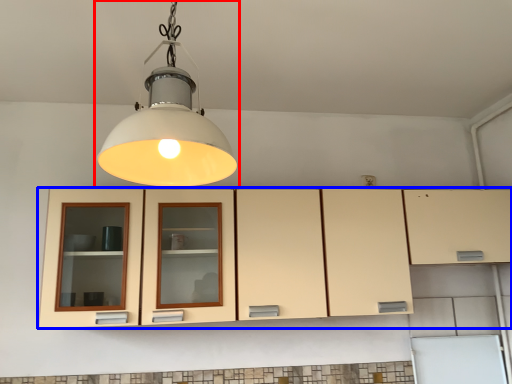
Question: Which object appears farthest to the camera in this image, lamp (highlighted by a red box) or cabinetry (highlighted by a blue box)?

Choices:
 (A) lamp
 (B) cabinetry

Answer: (B)